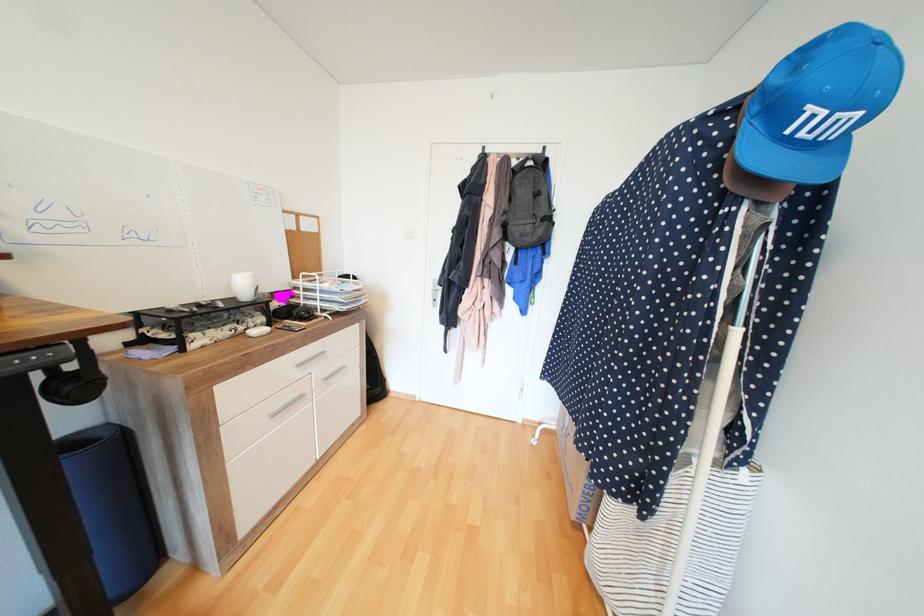
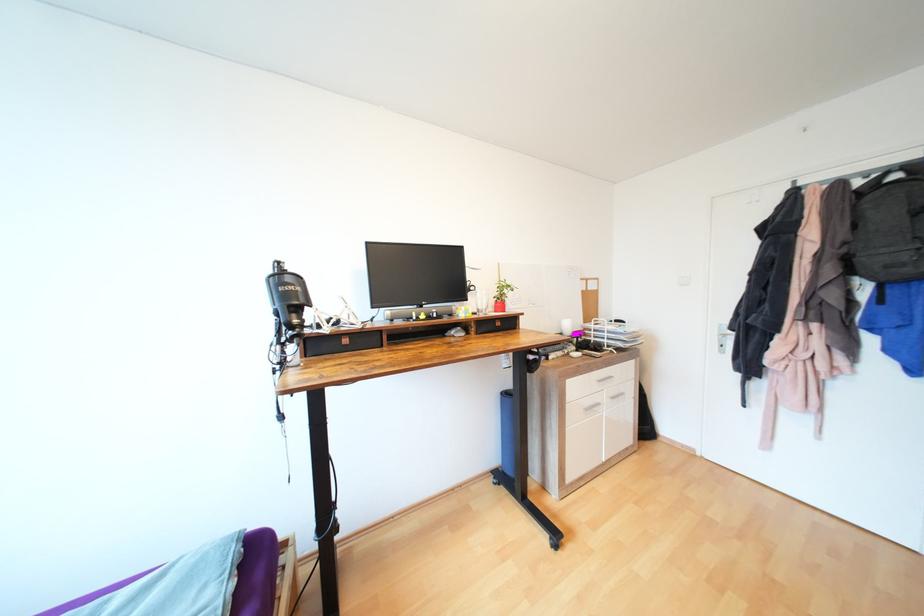
Question: The camera is either moving clockwise (left) or counter-clockwise (right) around the object. The first image is from the beginning of the video and the second image is from the end. Is the camera moving left or right when shooting the video?

Choices:
 (A) Left
 (B) Right

Answer: (B)